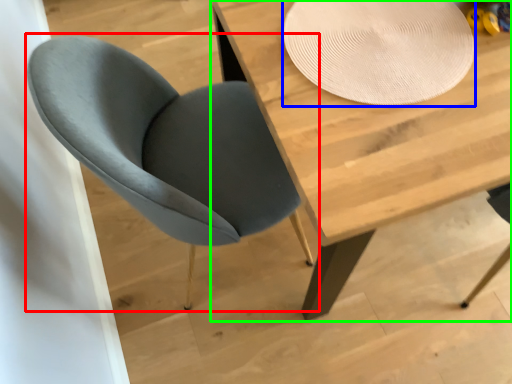
Question: Based on their relative distances, which object is nearer to chair (highlighted by a red box)? Choose from paper plate (highlighted by a blue box) and table (highlighted by a green box).

Choices:
 (A) paper plate
 (B) table

Answer: (B)